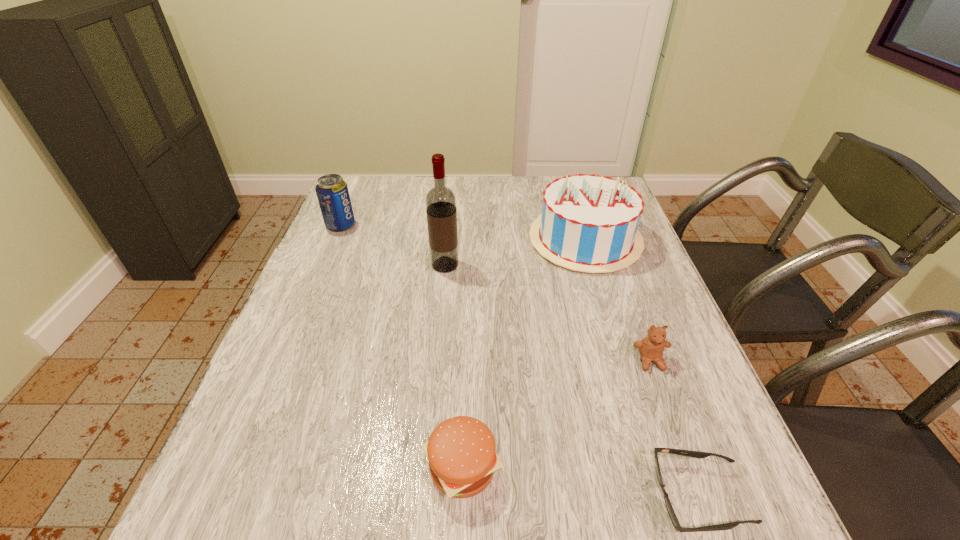
I want to click on blank space located 0.100m on the face of the third nearest object, so click(670, 416).

The width and height of the screenshot is (960, 540). In order to click on vacant space located 0.080m on the right of the second shortest object in this screenshot , I will do `click(548, 467)`.

The height and width of the screenshot is (540, 960). I want to click on free space located on the front-facing side of the shortest object, so click(516, 497).

Locate an element on the screen. The height and width of the screenshot is (540, 960). vacant region located 0.050m on the front-facing side of the shortest object is located at coordinates (626, 497).

Find the location of a particular element. Image resolution: width=960 pixels, height=540 pixels. vacant space located on the front-facing side of the shortest object is located at coordinates (511, 497).

Find the location of a particular element. object present at the far edge is located at coordinates (589, 223).

At what (x,y) coordinates should I click in order to perform the action: click on hamburger that is at the near edge. Please return your answer as a coordinate pair (x, y). Looking at the image, I should click on (461, 451).

Identify the location of sunglasses located at the near edge. Image resolution: width=960 pixels, height=540 pixels. (696, 454).

I want to click on object that is at the left edge, so click(332, 192).

Find the location of `birthday cake present at the right edge`. birthday cake present at the right edge is located at coordinates (589, 223).